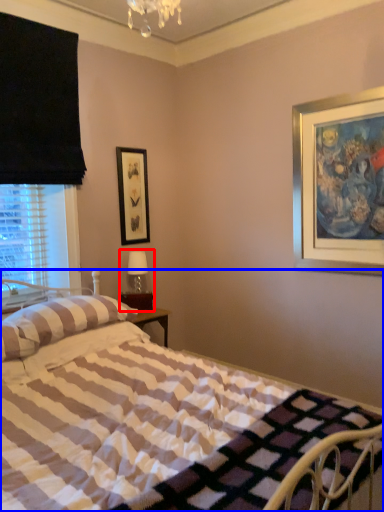
Question: Which object is further to the camera taking this photo, table lamp (highlighted by a red box) or bed (highlighted by a blue box)?

Choices:
 (A) table lamp
 (B) bed

Answer: (A)